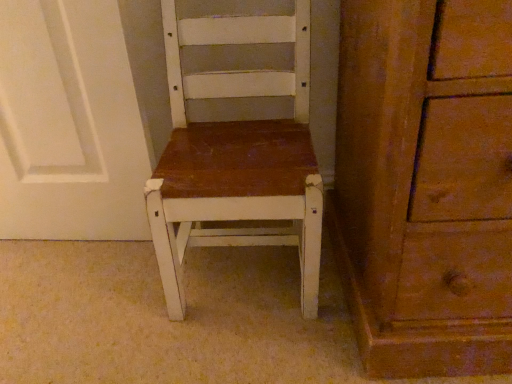
What do you see at coordinates (236, 139) in the screenshot?
I see `matte white chair at center` at bounding box center [236, 139].

What are the coordinates of `matte white chair at center` in the screenshot? It's located at (236, 139).

Where is `matte white chair at center`? matte white chair at center is located at coordinates (236, 139).